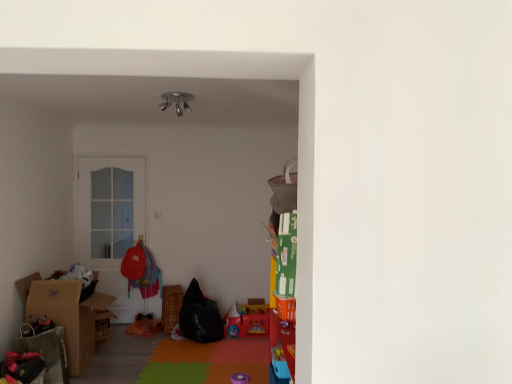
Locate an element on the screen. The height and width of the screenshot is (384, 512). blank space above white glass door at center (from a real-world perspective) is located at coordinates (117, 157).